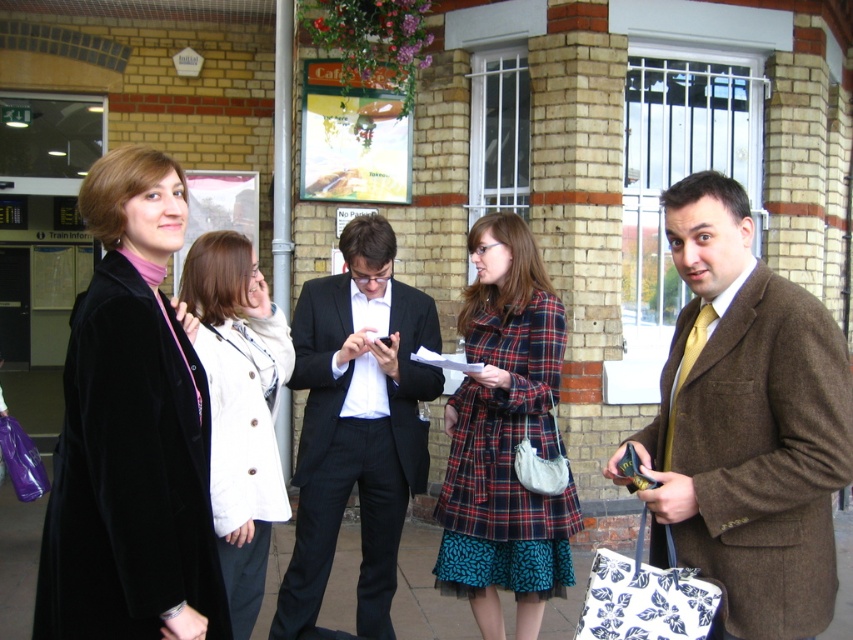
Is velvet black coat at left bigger than plaid fabric coat at center?

No, velvet black coat at left is not bigger than plaid fabric coat at center.

At what (x,y) coordinates should I click in order to perform the action: click on velvet black coat at left. Please return your answer as a coordinate pair (x, y). Looking at the image, I should click on click(131, 433).

Can you confirm if black wool suit at center is positioned above teal patterned skirt at center?

Correct, black wool suit at center is located above teal patterned skirt at center.

How much distance is there between black wool suit at center and teal patterned skirt at center?

The distance of black wool suit at center from teal patterned skirt at center is 24.13 inches.

Locate an element on the screen. The image size is (853, 640). black wool suit at center is located at coordinates (357, 426).

Locate an element on the screen. black wool suit at center is located at coordinates (357, 426).

Between white cotton jacket at center and smooth concrete pavement at center, which one appears on the right side from the viewer's perspective?

Positioned to the right is white cotton jacket at center.

Does white cotton jacket at center have a lesser height compared to smooth concrete pavement at center?

In fact, white cotton jacket at center may be taller than smooth concrete pavement at center.

This screenshot has width=853, height=640. In order to click on white cotton jacket at center in this screenshot , I will do `click(239, 408)`.